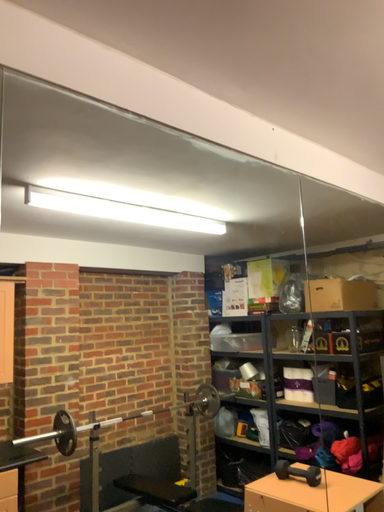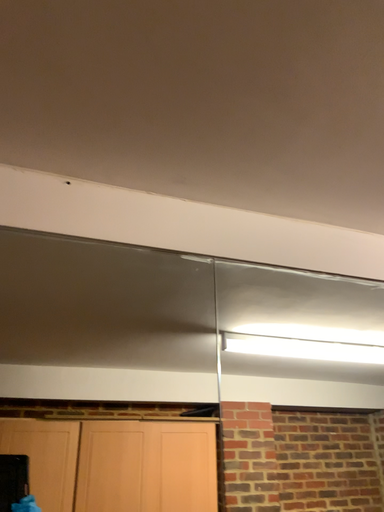
Question: Which way did the camera rotate in the video?

Choices:
 (A) rotated left
 (B) rotated right

Answer: (A)